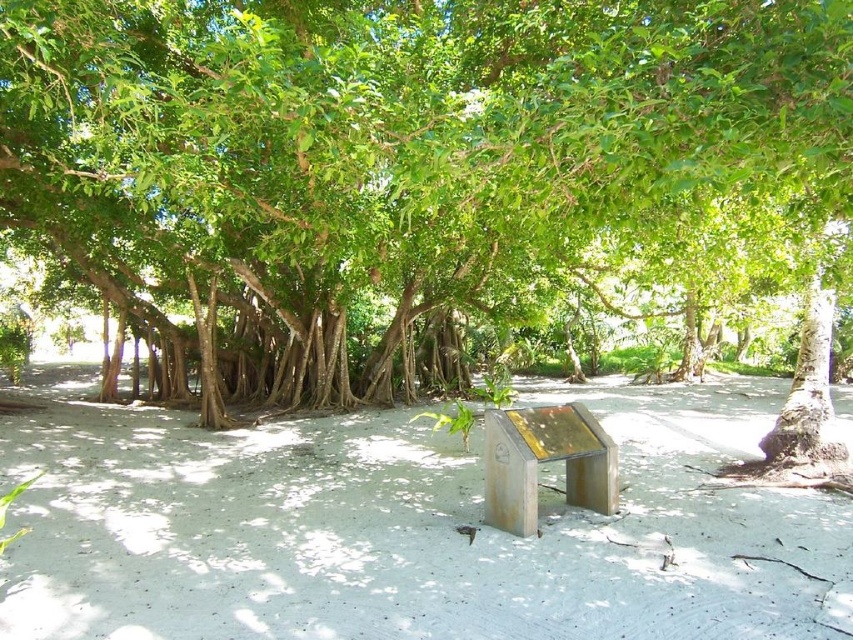
You are planning to set up a picnic blanket in the area. Given the green leafy tree at center and the white sandy soil at center, which one occupies more horizontal space in the image?

The green leafy tree at center might be wider than white sandy soil at center, so it likely occupies more horizontal space.

You are planning to plant a new tree in your backyard and want to know the size of the green leafy tree at center compared to the white sandy soil at center. Which one is larger?

The green leafy tree at center is bigger than the white sandy sandy soil at center, so the tree is larger.

In the scene shown: You are standing at the edge of the sandy area looking towards the tree. There is a point marked at coordinates [430,177]. Based on the scene description, can you determine what this point is located on?

The point [430,177] is on the green leafy tree at center.